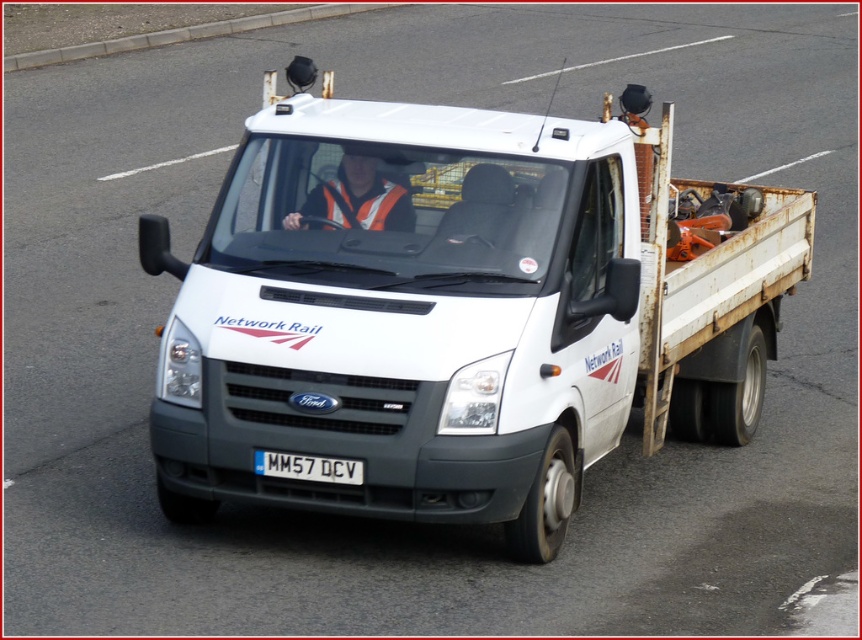
You are a traffic officer observing a white matte truck at center and a white plastic license plate at center. Which object is bigger?

The white matte truck at center is larger in size than the white plastic license plate at center.

You are a pedestrian standing at the side of the road where the white Ford Transit van is driving. You notice two items at the center of the van. Which item is taller between the reflective orange vest at center and the white plastic license plate at center?

The reflective orange vest at center is taller than the white plastic license plate at center.

You are a pedestrian standing on the sidewalk next to the road where the white matte truck at center and the reflective orange vest at center are located. You want to cross the road safely. Which object should you look towards first to ensure the truck driver sees you?

You should look towards the reflective orange vest at center first because it is positioned above the white matte truck at center, making it more visible to the driver.